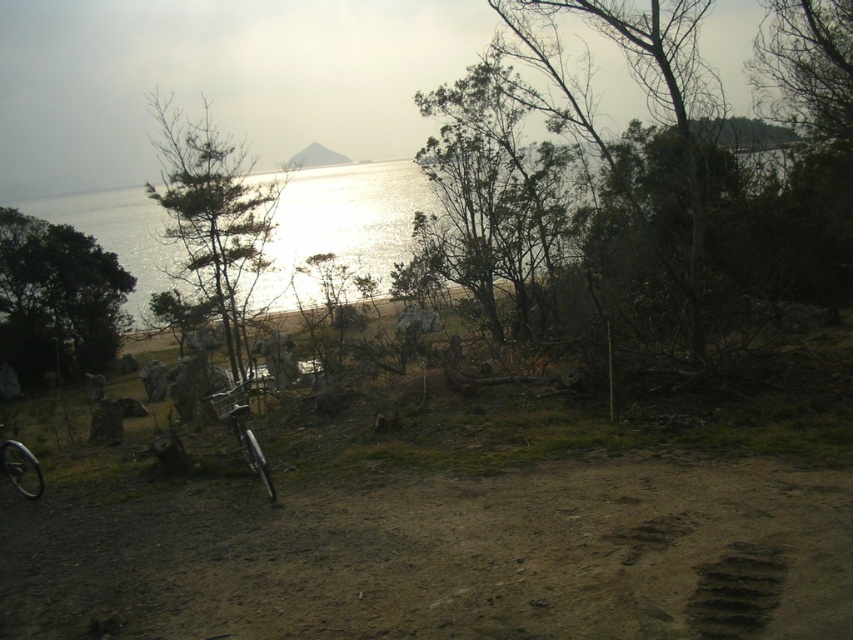
How far apart are green leafy tree at center and green matte tree at left?

43.28 feet

Which is more to the right, green leafy tree at center or green matte tree at left?

From the viewer's perspective, green leafy tree at center appears more on the right side.

Measure the distance between point (538, 237) and camera.

Point (538, 237) is 20.41 meters away from camera.

The image size is (853, 640). Identify the location of green leafy tree at center. (492, 198).

You are a GUI agent. You are given a task and a screenshot of the screen. Output one action in this format:
    pyautogui.click(x=<x>, y=<y>)
    Task: Click on the brown dirt field at center
    
    Given the screenshot: What is the action you would take?
    pyautogui.click(x=440, y=557)

Locate an element on the screen. brown dirt field at center is located at coordinates (440, 557).

Between point (96, 324) and point (24, 465), which one is positioned behind?

The point (96, 324) is more distant.

Which is in front, point (7, 230) or point (16, 456)?

Point (16, 456) is in front.

You are a GUI agent. You are given a task and a screenshot of the screen. Output one action in this format:
    pyautogui.click(x=<x>, y=<y>)
    Task: Click on the green matte tree at left
    
    Given the screenshot: What is the action you would take?
    (x=56, y=300)